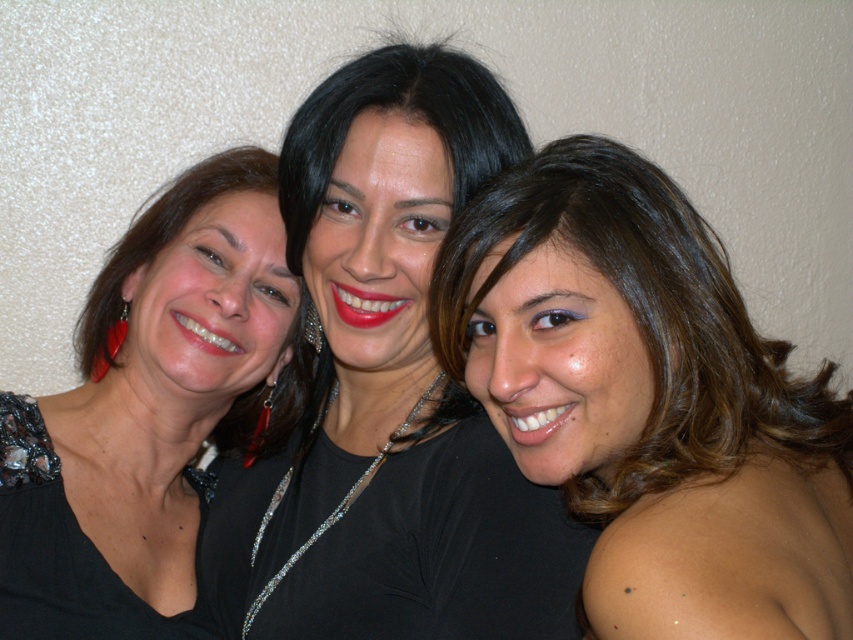
Question: Among these points, which one is nearest to the camera?

Choices:
 (A) (190, 422)
 (B) (720, 374)
 (C) (413, 500)

Answer: (B)

Question: Among these points, which one is nearest to the camera?

Choices:
 (A) (462, 573)
 (B) (216, 252)

Answer: (A)

Question: Which of the following is the closest to the observer?

Choices:
 (A) matte black shirt at center
 (B) brown shiny hair at center

Answer: (B)

Question: Does matte black shirt at center have a lesser width compared to matte black dress at left?

Choices:
 (A) no
 (B) yes

Answer: (A)

Question: Can you confirm if brown shiny hair at center is wider than matte black dress at left?

Choices:
 (A) no
 (B) yes

Answer: (B)

Question: Considering the relative positions of brown shiny hair at center and matte black dress at left in the image provided, where is brown shiny hair at center located with respect to matte black dress at left?

Choices:
 (A) above
 (B) below

Answer: (A)